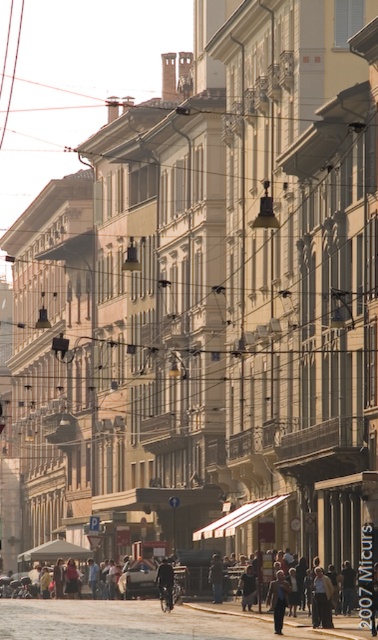
Question: From the image, what is the correct spatial relationship of dark blue fabric jacket at center in relation to dark gray fabric jacket at center?

Choices:
 (A) below
 (B) above

Answer: (A)

Question: Which object is positioned farthest from the dark blue jeans at center?

Choices:
 (A) dark gray fabric jacket at center
 (B) dark gray jacket at center

Answer: (B)

Question: Where is shiny black car at center located in relation to dark blue fabric jacket at center in the image?

Choices:
 (A) right
 (B) left

Answer: (B)

Question: Which point is farther to the camera?

Choices:
 (A) 221,566
 (B) 246,595
 (C) 269,593
 (D) 175,593

Answer: (A)

Question: Which object is closer to the camera taking this photo?

Choices:
 (A) dark blue fabric jacket at center
 (B) dark blue jeans at center
 (C) dark gray fabric jacket at center

Answer: (B)

Question: Is dark blue jeans at center to the left of dark blue fabric jacket at center from the viewer's perspective?

Choices:
 (A) yes
 (B) no

Answer: (B)